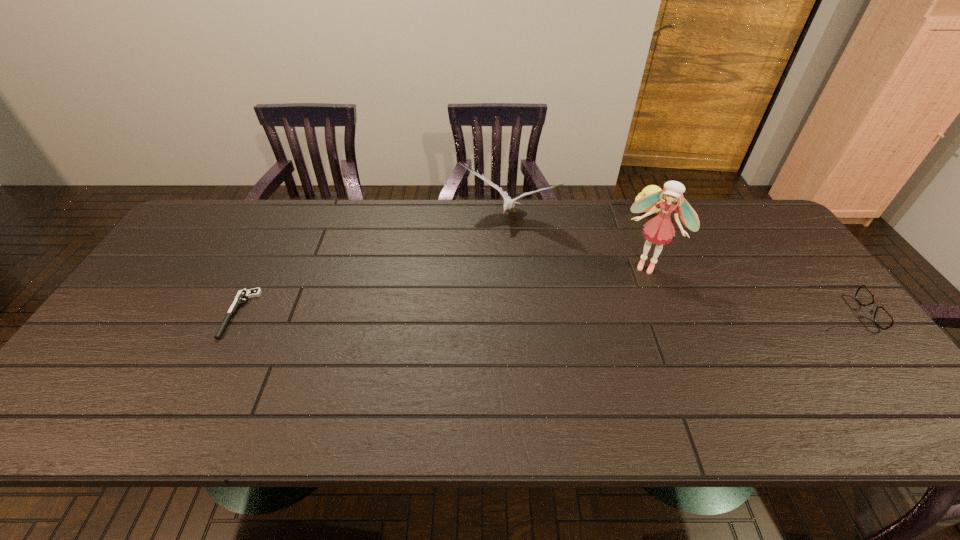
The height and width of the screenshot is (540, 960). I want to click on vacant area that lies between the doll and the fourth shortest object, so click(x=578, y=240).

At what (x,y) coordinates should I click in order to perform the action: click on unoccupied area between the duckling and the pistol. Please return your answer as a coordinate pair (x, y). Looking at the image, I should click on (444, 261).

The image size is (960, 540). Find the location of `free space between the third shortest object and the second shortest object`. free space between the third shortest object and the second shortest object is located at coordinates (743, 261).

The height and width of the screenshot is (540, 960). I want to click on free spot between the gull and the third tallest object, so click(x=578, y=213).

Image resolution: width=960 pixels, height=540 pixels. Identify the location of free space between the fourth object from right to left and the third shortest object. (578, 213).

The image size is (960, 540). In order to click on object that is the third closest to the duckling in this screenshot , I will do `click(882, 318)`.

Image resolution: width=960 pixels, height=540 pixels. Find the location of `the second closest object relative to the third farthest object`. the second closest object relative to the third farthest object is located at coordinates (509, 203).

The image size is (960, 540). I want to click on vacant position in the image that satisfies the following two spatial constraints: 1. on the back side of the duckling; 2. on the left side of the tallest object, so click(x=627, y=209).